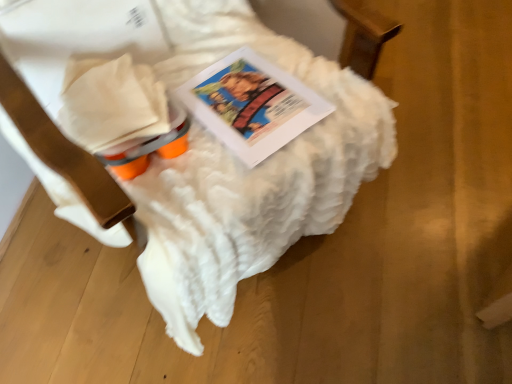
Locate an element on the screen. The width and height of the screenshot is (512, 384). blank space above matte paper book at center (from a real-world perspective) is located at coordinates click(253, 94).